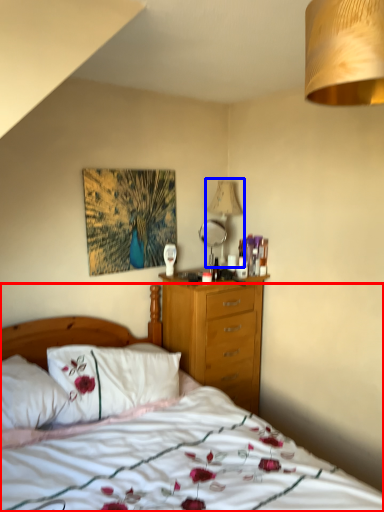
Question: Among these objects, which one is nearest to the camera, bed (highlighted by a red box) or lamp (highlighted by a blue box)?

Choices:
 (A) bed
 (B) lamp

Answer: (A)